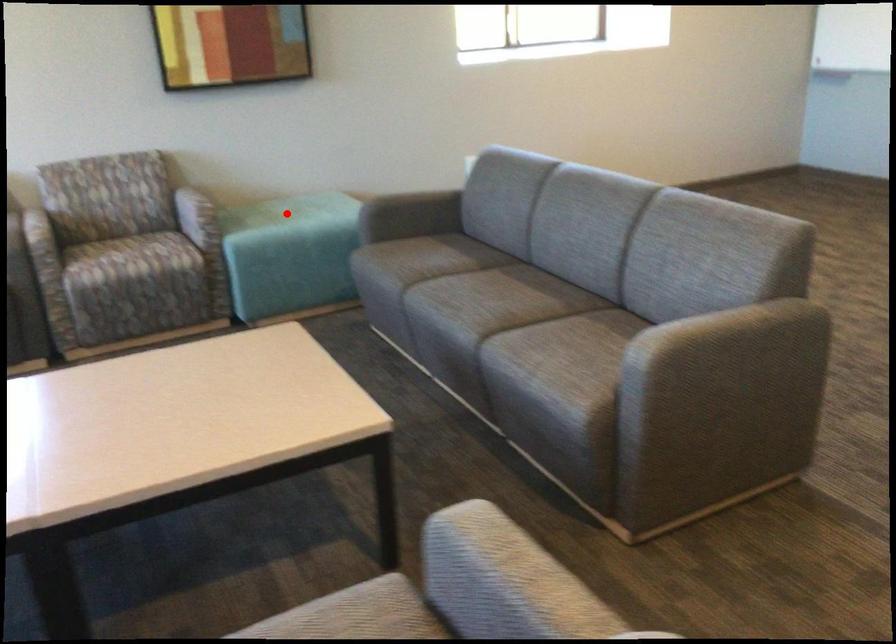
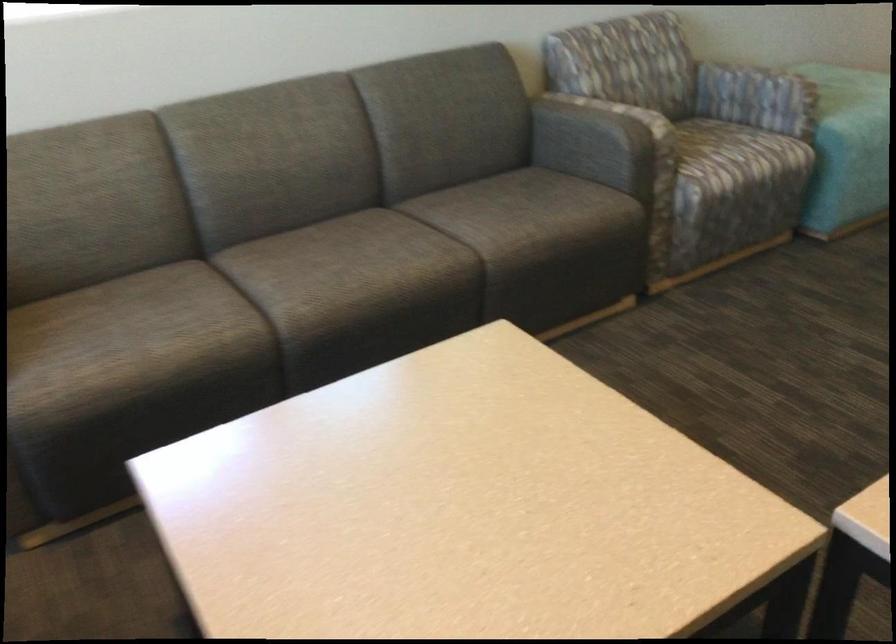
Question: I am providing you with two images of the same scene from different viewpoints. A red point is marked on the first image. Can you still see the location of the red point in image 2?

Choices:
 (A) Yes
 (B) No

Answer: (B)